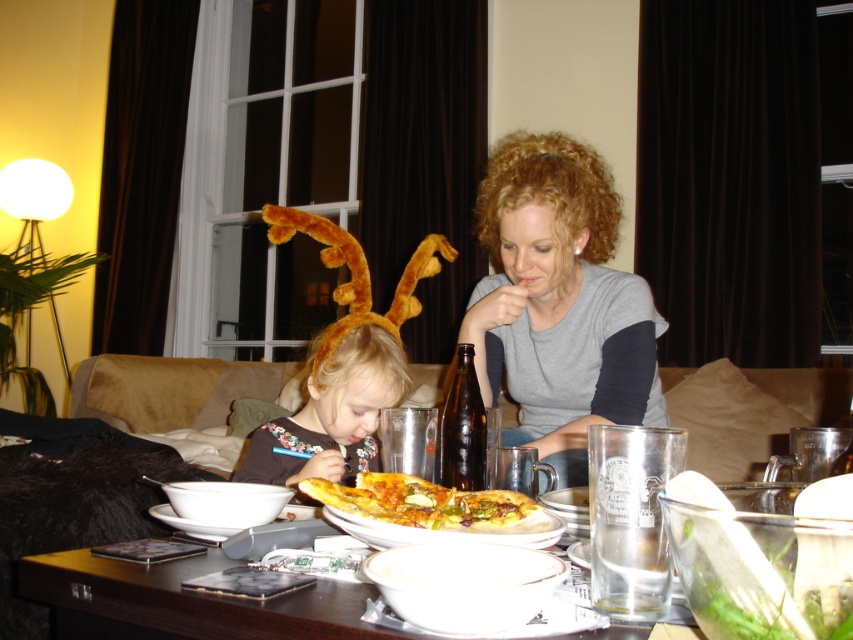
In the scene shown: Is gray matte shirt at center above golden crusty pizza at center?

Yes.

Who is higher up, gray matte shirt at center or golden crusty pizza at center?

gray matte shirt at center

You are a GUI agent. You are given a task and a screenshot of the screen. Output one action in this format:
    pyautogui.click(x=<x>, y=<y>)
    Task: Click on the gray matte shirt at center
    
    Given the screenshot: What is the action you would take?
    pyautogui.click(x=560, y=300)

The image size is (853, 640). I want to click on gray matte shirt at center, so click(x=560, y=300).

In the scene shown: Who is higher up, matte brown hair at center or brown glass bottle at center?

brown glass bottle at center

Does matte brown hair at center have a lesser width compared to brown glass bottle at center?

In fact, matte brown hair at center might be wider than brown glass bottle at center.

The width and height of the screenshot is (853, 640). Identify the location of matte brown hair at center. (332, 412).

Image resolution: width=853 pixels, height=640 pixels. Identify the location of matte brown hair at center. (332, 412).

Can you confirm if wooden table at center is positioned below golden crispy pizza at center?

Indeed, wooden table at center is positioned under golden crispy pizza at center.

Which is above, wooden table at center or golden crispy pizza at center?

golden crispy pizza at center is above.

The image size is (853, 640). What do you see at coordinates (184, 602) in the screenshot?
I see `wooden table at center` at bounding box center [184, 602].

Where is `wooden table at center`? Image resolution: width=853 pixels, height=640 pixels. wooden table at center is located at coordinates (184, 602).